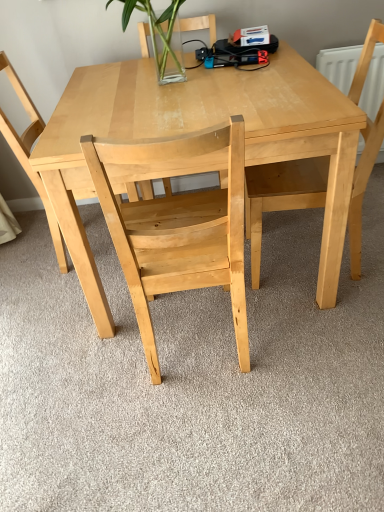
Question: Does natural wood chair at upper right, placed as the 3th chair when sorted from left to right, have a lesser height compared to natural wood chair at center, positioned as the 2th chair in right-to-left order?

Choices:
 (A) yes
 (B) no

Answer: (A)

Question: Is natural wood chair at upper right, placed as the first chair when sorted from right to left, thinner than natural wood chair at center, positioned as the 2th chair in right-to-left order?

Choices:
 (A) no
 (B) yes

Answer: (A)

Question: Is natural wood chair at upper right, placed as the first chair when sorted from right to left, further to the viewer compared to natural wood chair at center, positioned as the 2th chair in right-to-left order?

Choices:
 (A) no
 (B) yes

Answer: (B)

Question: From the image's perspective, would you say natural wood chair at upper right, placed as the first chair when sorted from right to left, is shown under natural wood chair at center, the 2th chair viewed from the left?

Choices:
 (A) yes
 (B) no

Answer: (B)

Question: Is natural wood chair at upper right, placed as the first chair when sorted from right to left, aimed at natural wood chair at center, positioned as the 2th chair in right-to-left order?

Choices:
 (A) yes
 (B) no

Answer: (B)

Question: Is natural wood chair at upper right, placed as the first chair when sorted from right to left, oriented away from natural wood chair at center, the 2th chair viewed from the left?

Choices:
 (A) yes
 (B) no

Answer: (B)

Question: Is natural wood chair at center, the 3th chair viewed from the right, at the back of natural wood chair at upper right, placed as the first chair when sorted from right to left?

Choices:
 (A) yes
 (B) no

Answer: (B)

Question: Is natural wood chair at upper right, placed as the 3th chair when sorted from left to right, taller than natural wood chair at center, the 3th chair viewed from the right?

Choices:
 (A) yes
 (B) no

Answer: (B)

Question: Considering the relative positions of natural wood chair at upper right, placed as the 3th chair when sorted from left to right, and natural wood chair at center, which appears as the first chair when viewed from the left, in the image provided, is natural wood chair at upper right, placed as the 3th chair when sorted from left to right, to the left of natural wood chair at center, which appears as the first chair when viewed from the left, from the viewer's perspective?

Choices:
 (A) yes
 (B) no

Answer: (B)

Question: Are natural wood chair at upper right, placed as the first chair when sorted from right to left, and natural wood chair at center, the 3th chair viewed from the right, beside each other?

Choices:
 (A) no
 (B) yes

Answer: (A)

Question: Considering the relative sizes of natural wood chair at upper right, placed as the 3th chair when sorted from left to right, and natural wood chair at center, which appears as the first chair when viewed from the left, in the image provided, is natural wood chair at upper right, placed as the 3th chair when sorted from left to right, bigger than natural wood chair at center, which appears as the first chair when viewed from the left,?

Choices:
 (A) no
 (B) yes

Answer: (B)

Question: From a real-world perspective, is natural wood chair at upper right, placed as the 3th chair when sorted from left to right, beneath natural wood chair at center, which appears as the first chair when viewed from the left?

Choices:
 (A) no
 (B) yes

Answer: (B)

Question: Considering the relative positions of natural wood table at center and natural wood chair at center, positioned as the 2th chair in right-to-left order, in the image provided, is natural wood table at center to the right of natural wood chair at center, positioned as the 2th chair in right-to-left order, from the viewer's perspective?

Choices:
 (A) yes
 (B) no

Answer: (A)